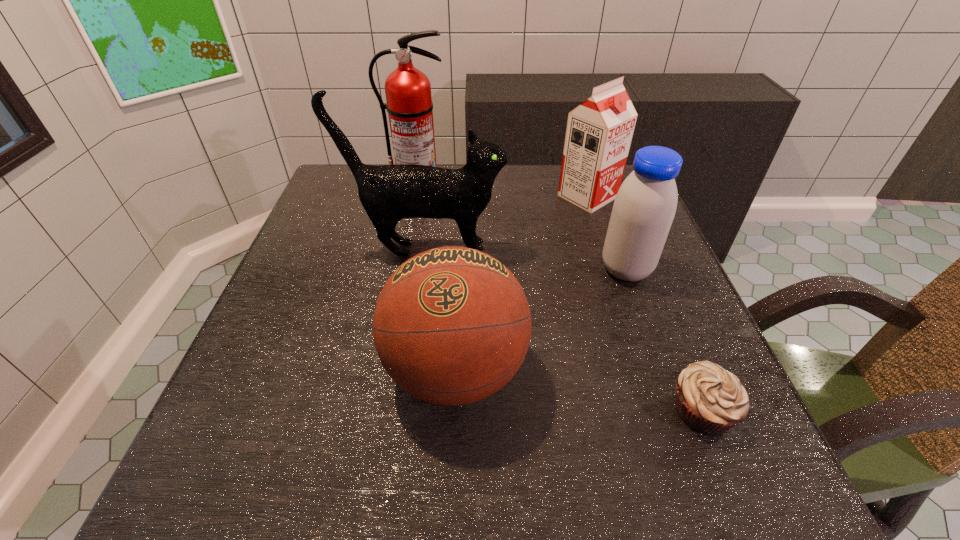
I want to click on blank region between the farther soya milk and the fire extinguisher, so click(x=502, y=190).

Where is `free space that is in between the basketball and the farther soya milk`? Image resolution: width=960 pixels, height=540 pixels. free space that is in between the basketball and the farther soya milk is located at coordinates (521, 284).

Find the location of a particular element. The height and width of the screenshot is (540, 960). free space between the farther soya milk and the basketball is located at coordinates 521,284.

Choose which object is the fourth nearest neighbor to the nearer soya milk. Please provide its 2D coordinates. Your answer should be formatted as a tuple, i.e. [(x, y)], where the tuple contains the x and y coordinates of a point satisfying the conditions above.

[(710, 400)]

Identify the location of object that is the fifth nearest to the cat. (710, 400).

The image size is (960, 540). What are the coordinates of `free region that satisfies the following two spatial constraints: 1. at the nozzle of the muffin; 2. on the right side of the fire extinguisher` in the screenshot? It's located at (372, 410).

I want to click on free location that satisfies the following two spatial constraints: 1. at the nozzle of the fire extinguisher; 2. on the left side of the muffin, so point(372,410).

Find the location of a particular element. The width and height of the screenshot is (960, 540). blank space that satisfies the following two spatial constraints: 1. on the face of the basketball; 2. on the right side of the cat is located at coordinates (409, 371).

Image resolution: width=960 pixels, height=540 pixels. In order to click on vacant position in the image that satisfies the following two spatial constraints: 1. on the back side of the basketball; 2. on the face of the cat in this screenshot , I will do `click(462, 249)`.

You are a GUI agent. You are given a task and a screenshot of the screen. Output one action in this format:
    pyautogui.click(x=<x>, y=<y>)
    Task: Click on the vacant space that satisfies the following two spatial constraints: 1. on the front side of the nearer soya milk; 2. on the left side of the farther soya milk
    The height and width of the screenshot is (540, 960).
    Given the screenshot: What is the action you would take?
    pyautogui.click(x=612, y=270)